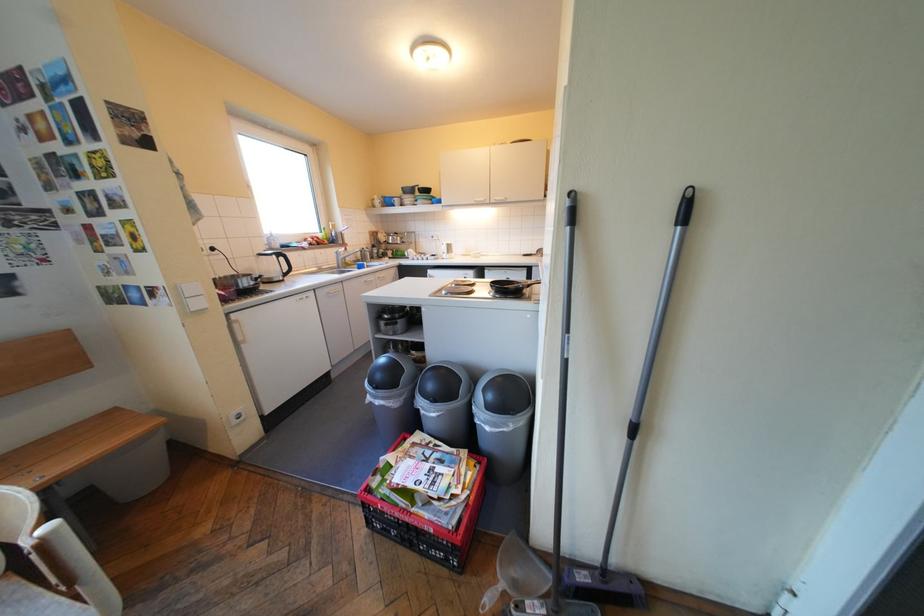
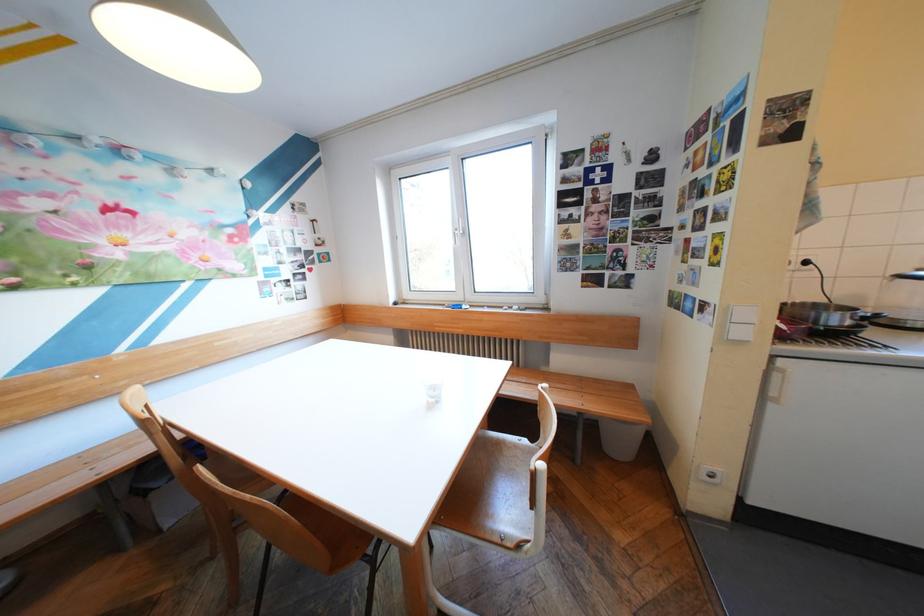
In the second image, find the point that corresponds to point 260,282 in the first image.

(849, 318)